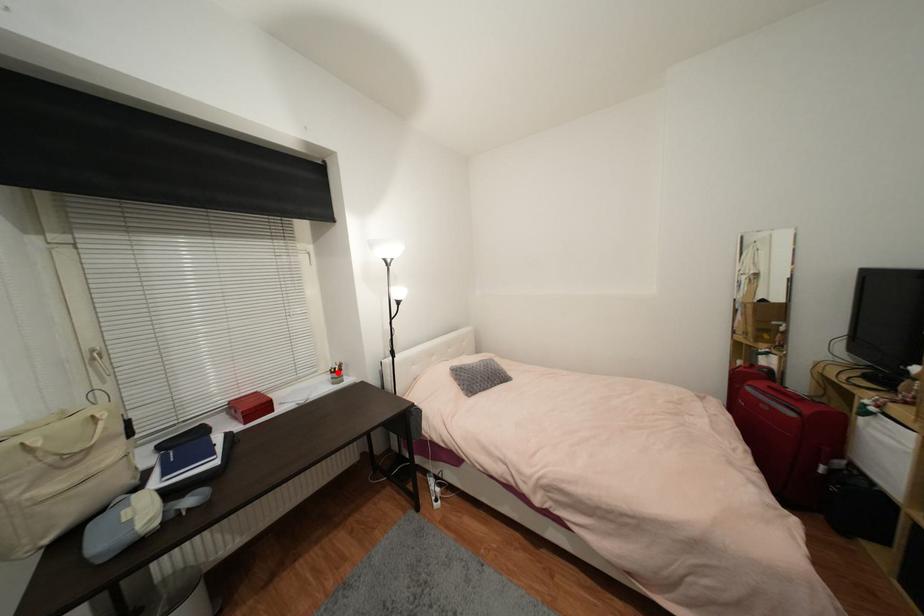
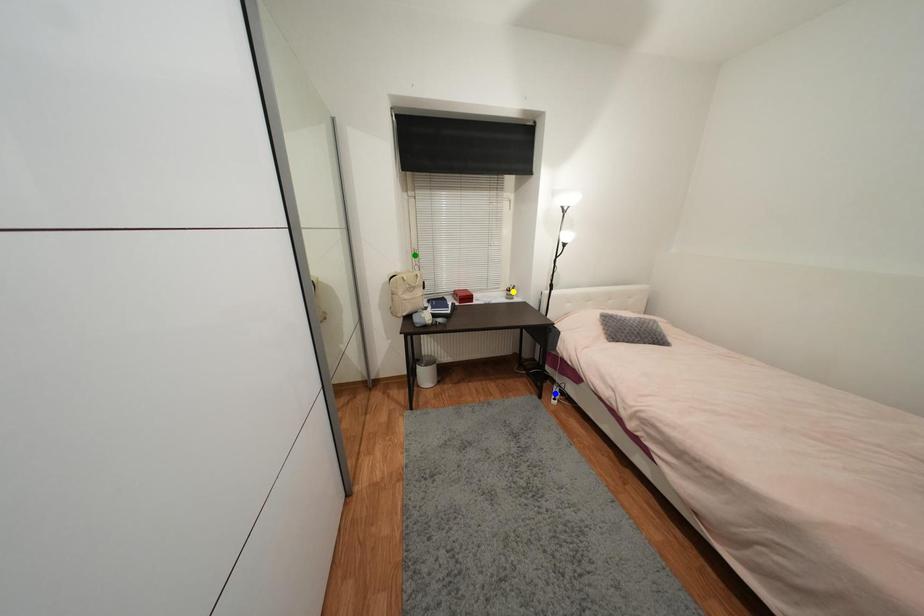
Question: I am providing you with two images of the same scene from different viewpoints. A red point is marked on the first image. You are given multiple points on the second image. Which spot in image 2 lines up with the point in image 1?

Choices:
 (A) blue point
 (B) yellow point
 (C) green point

Answer: (B)